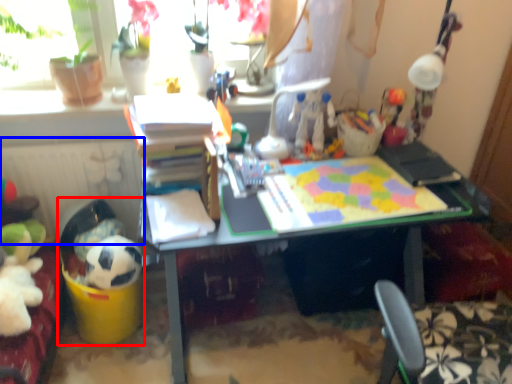
Question: Among these objects, which one is farthest to the camera, toy (highlighted by a red box) or radiator (highlighted by a blue box)?

Choices:
 (A) toy
 (B) radiator

Answer: (B)